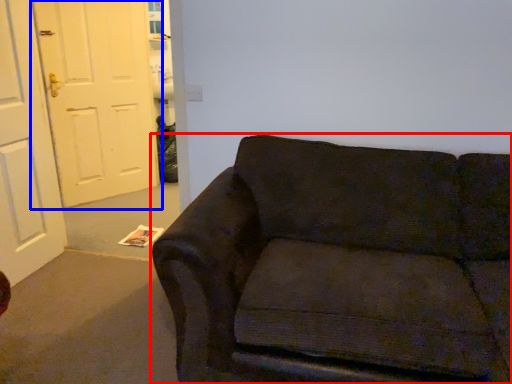
Question: Among these objects, which one is farthest to the camera, studio couch (highlighted by a red box) or door (highlighted by a blue box)?

Choices:
 (A) studio couch
 (B) door

Answer: (B)